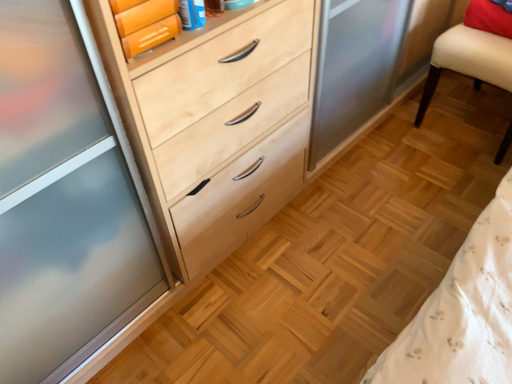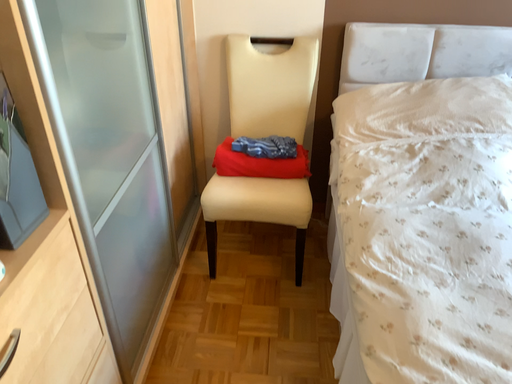
Question: How did the camera likely rotate when shooting the video?

Choices:
 (A) rotated upward
 (B) rotated downward

Answer: (A)